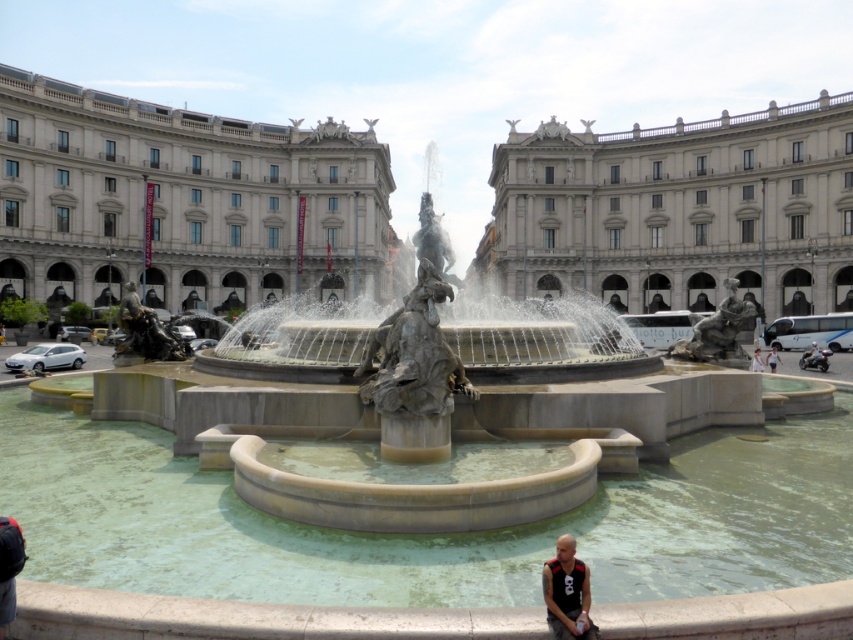
Measure the distance from white marble palace at center to white cotton shirt at lower right.

white marble palace at center and white cotton shirt at lower right are 40.55 meters apart from each other.

Is point (693, 212) positioned before point (773, 360)?

No, it is behind (773, 360).

Between point (824, 280) and point (769, 349), which one is positioned behind?

The point (824, 280) is behind.

I want to click on white marble palace at center, so click(x=680, y=211).

What do you see at coordinates (183, 202) in the screenshot?
I see `beige stone palace at center` at bounding box center [183, 202].

Is beige stone palace at center positioned in front of white fabric person at center?

No.

Locate an element on the screen. The width and height of the screenshot is (853, 640). beige stone palace at center is located at coordinates (183, 202).

Locate an element on the screen. beige stone palace at center is located at coordinates (183, 202).

Between beige stone palace at center and white cotton shirt at lower right, which one is positioned higher?

Positioned higher is beige stone palace at center.

This screenshot has width=853, height=640. Describe the element at coordinates (183, 202) in the screenshot. I see `beige stone palace at center` at that location.

You are a GUI agent. You are given a task and a screenshot of the screen. Output one action in this format:
    pyautogui.click(x=<x>, y=<y>)
    Task: Click on the beige stone palace at center
    
    Given the screenshot: What is the action you would take?
    pyautogui.click(x=183, y=202)